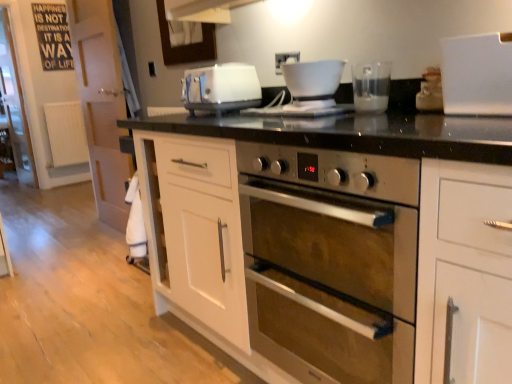
Question: In the image, is white glossy bowl at upper center, the first coffee machine positioned from the left, positioned in front of or behind stainless steel oven at center?

Choices:
 (A) behind
 (B) front

Answer: (A)

Question: In terms of size, does white glossy bowl at upper center, the first coffee machine positioned from the left, appear bigger or smaller than stainless steel oven at center?

Choices:
 (A) small
 (B) big

Answer: (A)

Question: Estimate the real-world distances between objects in this image. Which object is farther from the white plastic electric outlet at upper center?

Choices:
 (A) transparent plastic coffee machine at upper center, placed as the first coffee machine when sorted from right to left
 (B) clear glass door at left, arranged as the second glass door when viewed from the front
 (C) white plastic container at upper right
 (D) stainless steel oven at center
 (E) white plastic toaster at center

Answer: (B)

Question: Which is farther from the white glossy bowl at upper center, placed as the second coffee machine when sorted from right to left?

Choices:
 (A) white plastic container at upper right
 (B) white plastic electric outlet at upper center
 (C) transparent glass door at left, the 2th glass door when ordered from back to front
 (D) transparent plastic coffee machine at upper center, placed as the first coffee machine when sorted from right to left
 (E) stainless steel oven at center

Answer: (C)